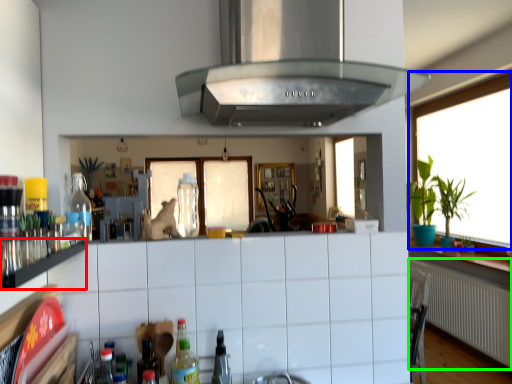
Question: Which is farther away from shelf (highlighted by a red box)? window (highlighted by a blue box) or radiator (highlighted by a green box)?

Choices:
 (A) window
 (B) radiator

Answer: (A)